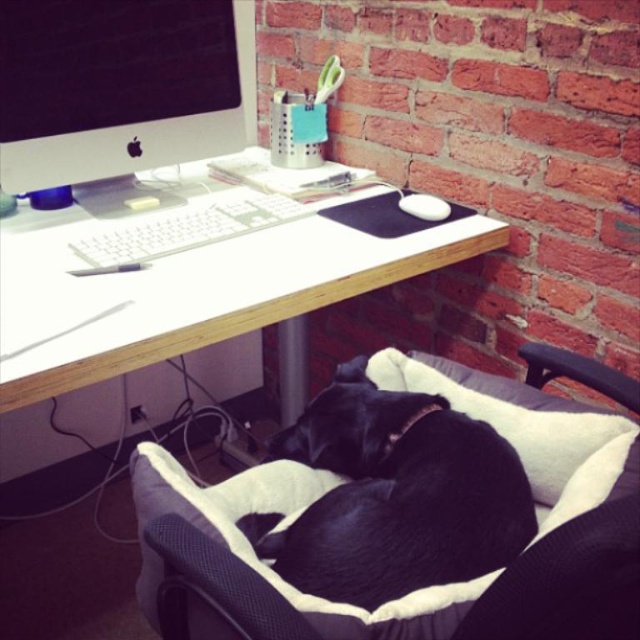
Question: Considering the relative positions of white wood computer desk at center and black soft dog at lower right in the image provided, where is white wood computer desk at center located with respect to black soft dog at lower right?

Choices:
 (A) below
 (B) above

Answer: (B)

Question: Is white wood computer desk at center positioned before matte black monitor at upper left?

Choices:
 (A) no
 (B) yes

Answer: (B)

Question: Considering the real-world distances, which object is closest to the white plastic keyboard at center?

Choices:
 (A) black soft dog at lower right
 (B) white wood computer desk at center

Answer: (B)

Question: Which point is farther to the camera?

Choices:
 (A) black soft dog at lower right
 (B) matte black monitor at upper left
 (C) white plastic keyboard at center
 (D) white wood computer desk at center

Answer: (B)

Question: Observing the image, what is the correct spatial positioning of matte black monitor at upper left in reference to white plastic keyboard at center?

Choices:
 (A) below
 (B) above

Answer: (B)

Question: Which point is farther from the camera taking this photo?

Choices:
 (A) (221, 51)
 (B) (464, 236)
 (C) (308, 531)

Answer: (A)